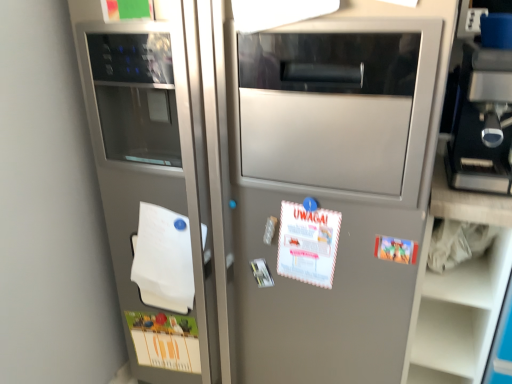
Question: From their relative heights in the image, would you say matte plastic postcard at right, arranged as the second postcard when ordered from the bottom, is taller or shorter than white paper at center, the second postcard viewed from the front?

Choices:
 (A) short
 (B) tall

Answer: (A)

Question: Considering their positions, is matte plastic postcard at right, marked as the first postcard in a front-to-back arrangement, located in front of or behind white paper at center, arranged as the second postcard when viewed from the left?

Choices:
 (A) front
 (B) behind

Answer: (A)

Question: Which object is the farthest from the matte plastic postcard at right, placed as the first postcard when sorted from right to left?

Choices:
 (A) white paper at center, which is counted as the 3th postcard, starting from the bottom
 (B) matte paper postcard at lower left, the 3th postcard in the right-to-left sequence
 (C) white matte notepad at left
 (D) black plastic coffee machine at upper right

Answer: (B)

Question: Considering the real-world distances, which object is closest to the matte paper postcard at lower left, the 3th postcard in the top-to-bottom sequence?

Choices:
 (A) white matte notepad at left
 (B) white paper at center, the first postcard when ordered from top to bottom
 (C) black plastic coffee machine at upper right
 (D) matte plastic postcard at right, which ranks as the third postcard in back-to-front order

Answer: (A)